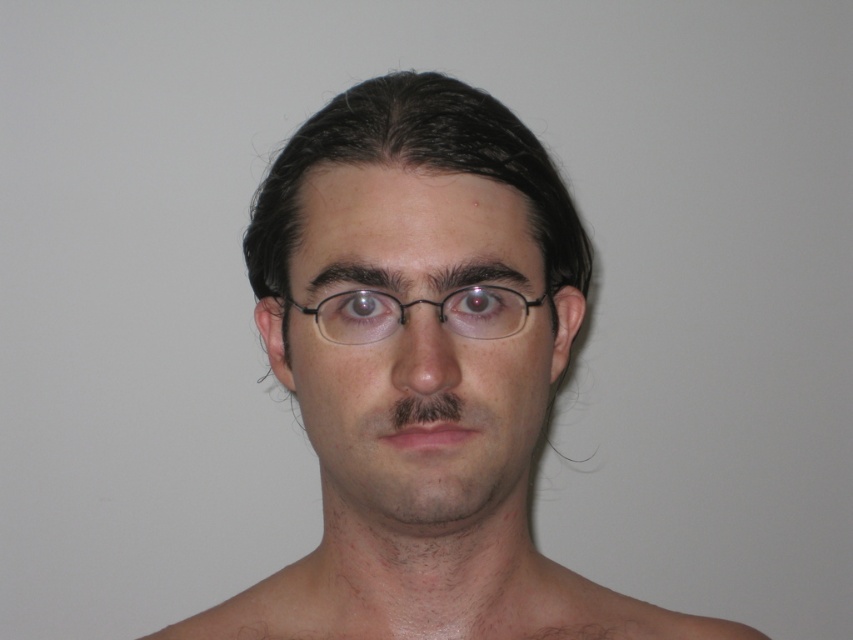
Is point (492, 556) more distant than point (503, 291)?

Yes, point (492, 556) is farther from viewer.

Is smooth skin man at center closer to the viewer compared to black plastic glasses at center?

That is True.

Does point (396, 228) come in front of point (404, 307)?

No.

The image size is (853, 640). Find the location of `smooth skin man at center`. smooth skin man at center is located at coordinates (422, 374).

Does smooth skin face at center appear over black plastic glasses at center?

Incorrect, smooth skin face at center is not positioned above black plastic glasses at center.

Who is more distant from viewer, (349,436) or (329,328)?

Point (349,436)

Image resolution: width=853 pixels, height=640 pixels. I want to click on smooth skin face at center, so click(416, 342).

Is smooth skin man at center above smooth skin face at center?

Incorrect, smooth skin man at center is not positioned above smooth skin face at center.

Describe the element at coordinates (422, 374) in the screenshot. This screenshot has width=853, height=640. I see `smooth skin man at center` at that location.

The height and width of the screenshot is (640, 853). In order to click on smooth skin man at center in this screenshot , I will do `click(422, 374)`.